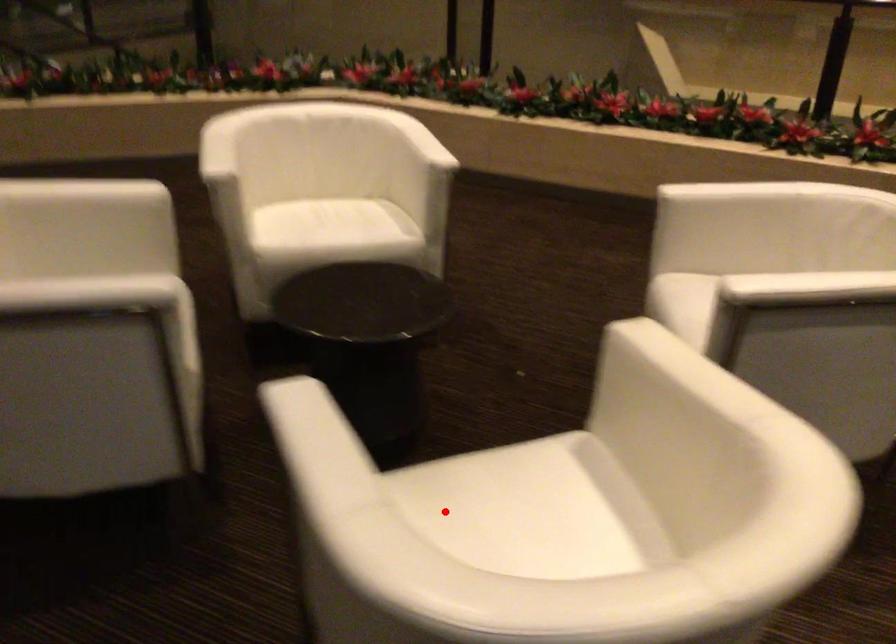
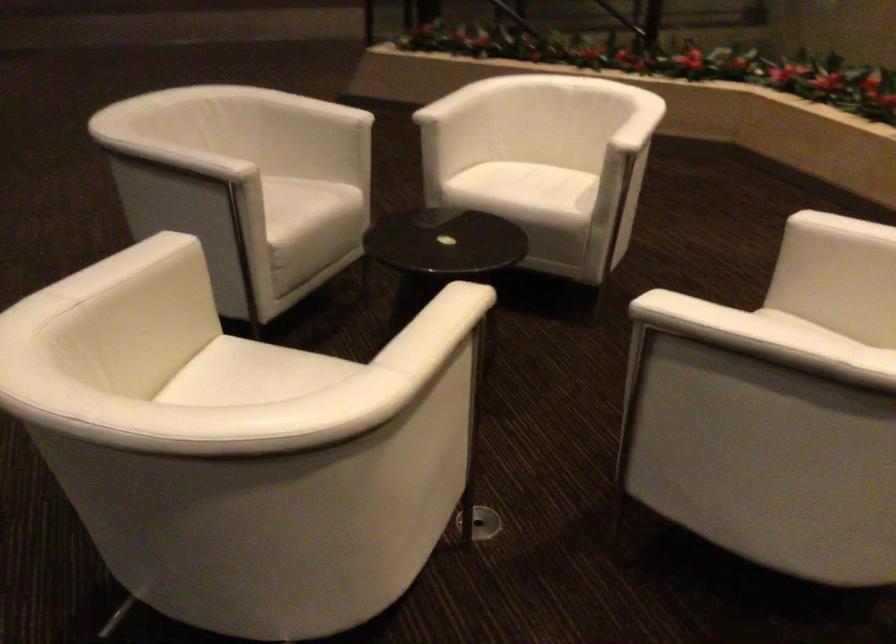
Question: I am providing you with two images of the same scene from different viewpoints. In image1, a red point is highlighted. Considering the same 3D point in image2, which of the following is correct?

Choices:
 (A) It is closer
 (B) It is farther

Answer: (B)